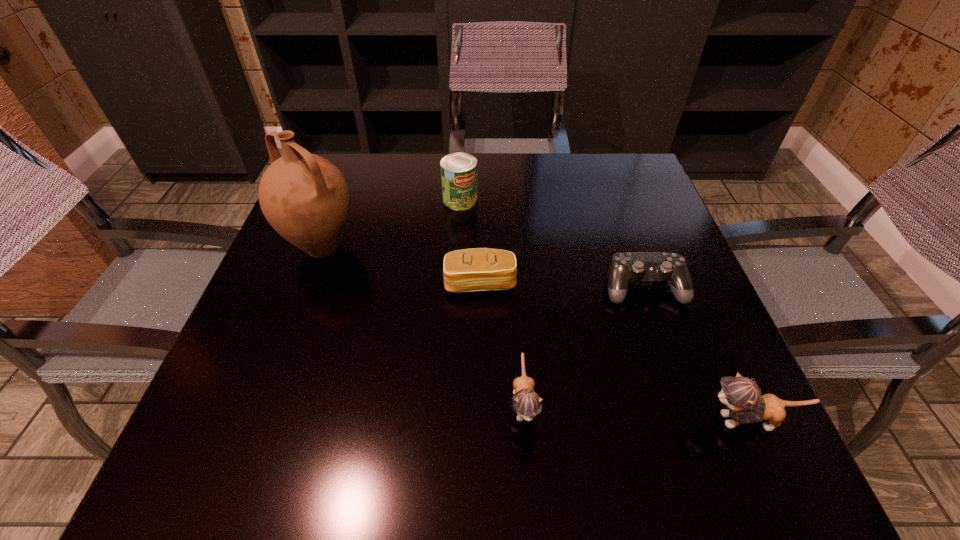
Locate an element on the screen. Image resolution: width=960 pixels, height=540 pixels. vacant space located 0.200m on the front-facing side of the taller kitten is located at coordinates (574, 420).

The width and height of the screenshot is (960, 540). What are the coordinates of `blank area located on the back of the can` in the screenshot? It's located at (463, 158).

This screenshot has height=540, width=960. I want to click on free space located 0.240m on the left of the control, so click(x=488, y=288).

Locate an element on the screen. This screenshot has width=960, height=540. vacant space located 0.170m on the back of the tallest object is located at coordinates tap(347, 183).

The height and width of the screenshot is (540, 960). In order to click on free location located on the zipper side of the clutch bag in this screenshot , I will do `click(480, 353)`.

This screenshot has width=960, height=540. I want to click on object located in the far edge section of the desktop, so click(x=458, y=170).

Find the location of `object positioned at the left edge`. object positioned at the left edge is located at coordinates (305, 198).

Locate an element on the screen. The height and width of the screenshot is (540, 960). kitten that is at the right edge is located at coordinates (746, 405).

Locate an element on the screen. This screenshot has height=540, width=960. control present at the right edge is located at coordinates click(x=625, y=267).

What are the coordinates of `object at the near right corner` in the screenshot? It's located at (746, 405).